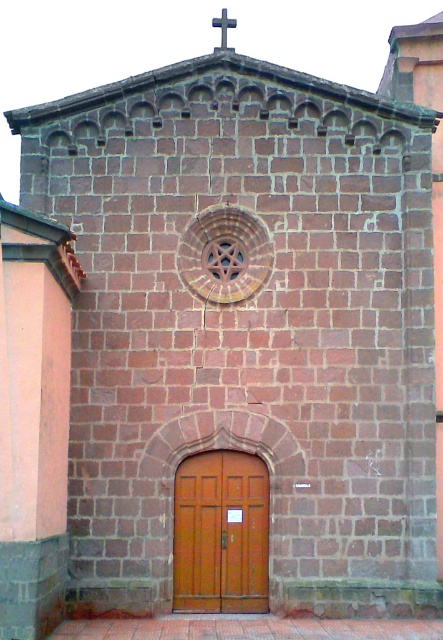
Does wooden door at center have a smaller size compared to white plastic cross at upper center?

Indeed, wooden door at center has a smaller size compared to white plastic cross at upper center.

Can you confirm if wooden door at center is wider than white plastic cross at upper center?

Yes, wooden door at center is wider than white plastic cross at upper center.

I want to click on wooden door at center, so click(x=221, y=532).